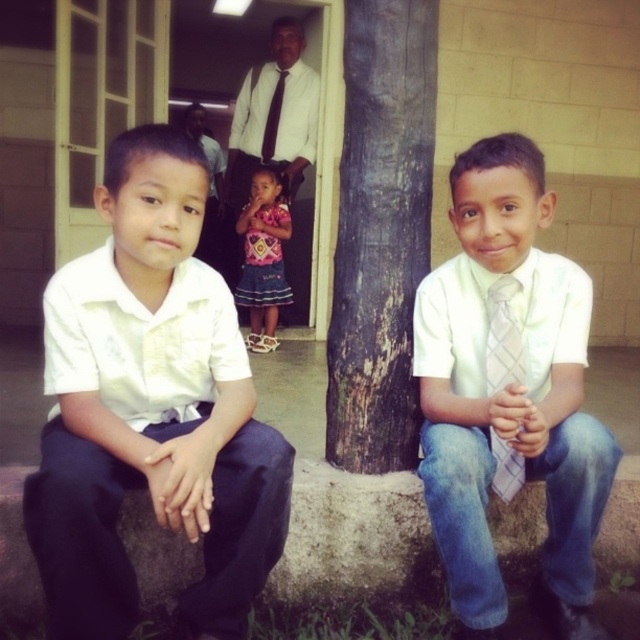
Question: Which of these objects is positioned closest to the white checkered tie at center?

Choices:
 (A) brown rough tree trunk at center
 (B) white satin shirt at left
 (C) pink fabric dress at center

Answer: (A)

Question: Is pink fabric dress at center thinner than black silk tie at upper center?

Choices:
 (A) no
 (B) yes

Answer: (A)

Question: Which object is farther from the camera taking this photo?

Choices:
 (A) white satin shirt at left
 (B) white woven tie at center
 (C) brown rough tree trunk at center

Answer: (C)

Question: Among these points, which one is nearest to the camera?

Choices:
 (A) (499, 332)
 (B) (253, 342)
 (C) (397, 337)

Answer: (A)

Question: Does brown rough tree trunk at center have a greater width compared to white checkered tie at center?

Choices:
 (A) yes
 (B) no

Answer: (A)

Question: Can you confirm if white woven tie at center is positioned below brown rough tree trunk at center?

Choices:
 (A) yes
 (B) no

Answer: (A)